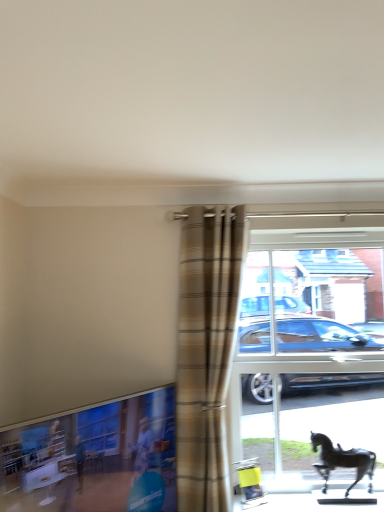
Question: Does point (142, 409) appear closer or farther from the camera than point (324, 466)?

Choices:
 (A) closer
 (B) farther

Answer: (A)

Question: In the image, is clear glass window at lower left positioned in front of or behind shiny black horse at lower right?

Choices:
 (A) front
 (B) behind

Answer: (A)

Question: Estimate the real-world distances between objects in this image. Which object is closer to the clear glass window at lower left?

Choices:
 (A) plaid fabric curtain at center
 (B) shiny black horse at lower right
 (C) transparent glass horse at right

Answer: (A)

Question: Estimate the real-world distances between objects in this image. Which object is farther from the plaid fabric curtain at center?

Choices:
 (A) shiny black horse at lower right
 (B) clear glass window at lower left
 (C) transparent glass horse at right

Answer: (A)